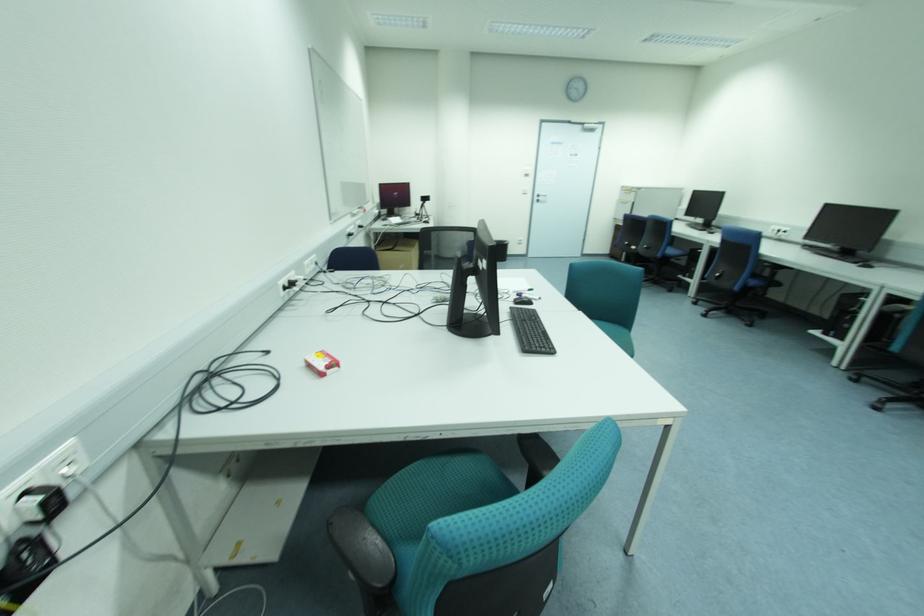
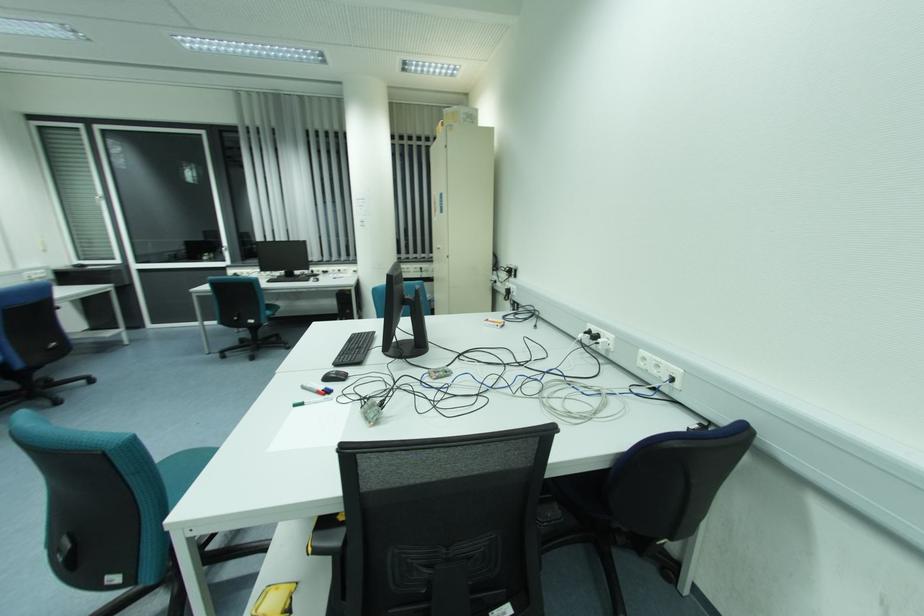
Where in the second image is the point corresponding to [285,288] from the first image?

(590, 333)